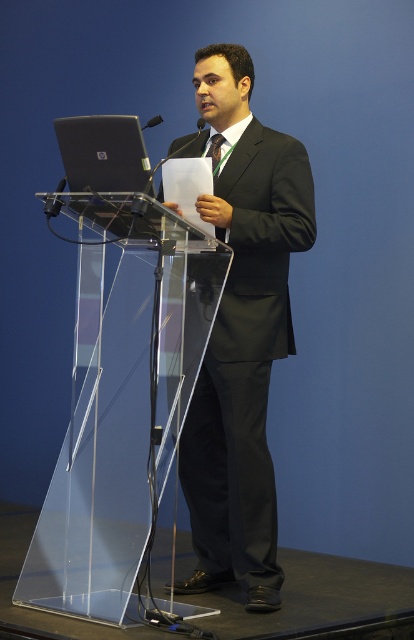
You are an attendee at the presentation. You notice two points on the podium. The first point is at coordinates point (x=206, y=86) and the second point is at coordinates point (x=127, y=150). Which point is closer to you?

Point (x=206, y=86) is closer to you because it is further to the viewer than point (x=127, y=150).

You are an attendee at the presentation and want to know which of the two points, point (130,134) or point (221,140), is closer to you. Can you determine this based on their positions?

Point (130,134) is closer to the viewer than point (221,140).

Consider the image. You are a photographer positioned in the front row of an audience. You need to capture a clear photo of the black glossy suit at center. Considering your camera has a minimum focusing distance of 3 meters, will you be able to take the photo without moving closer?

The distance between the black glossy suit at center and the viewer is 3.10 meters, which is just above the camera minimum focusing distance of 3 meters. Therefore, you can take the photo without moving closer.